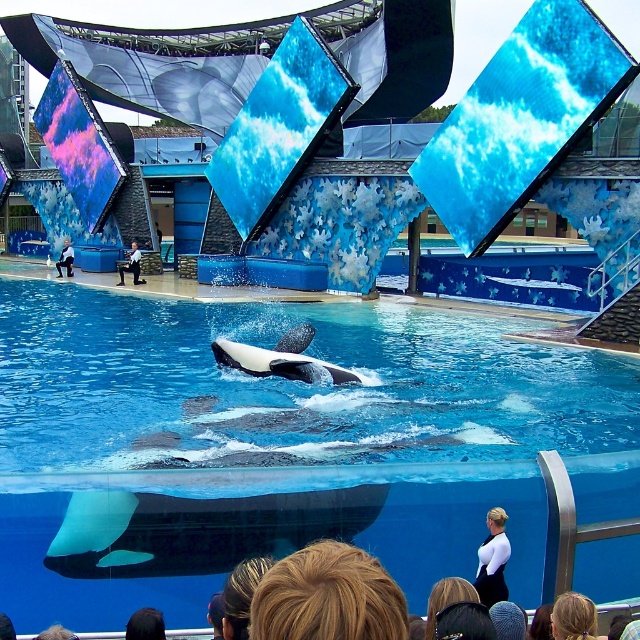
Question: Which point is closer to the camera?

Choices:
 (A) (227, 346)
 (B) (136, 264)
 (C) (129, 634)
 (D) (586, 628)

Answer: (D)

Question: Does blonde hair at lower center appear under white shirt at lower center?

Choices:
 (A) no
 (B) yes

Answer: (B)

Question: Does dark brown hair at lower center appear under black suit at center?

Choices:
 (A) yes
 (B) no

Answer: (A)

Question: Estimate the real-world distances between objects in this image. Which object is farther from the black suit at center?

Choices:
 (A) white shirt at lower center
 (B) black-and-white orca at center
 (C) white fabric at lower right
 (D) blonde hair at lower right

Answer: (D)

Question: Does blonde hair at lower center appear under white fabric at lower right?

Choices:
 (A) yes
 (B) no

Answer: (B)

Question: Which object is the closest to the blonde hair at lower right?

Choices:
 (A) transparent glass pool at center
 (B) blonde hair at lower center

Answer: (B)